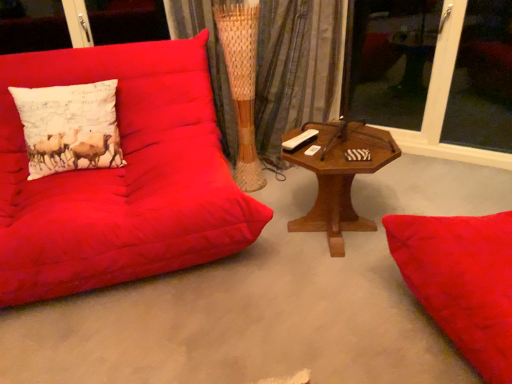
Question: Are transparent glass window at upper right, marked as the 2th window screen in a right-to-left arrangement, and woven fabric curtain at center located far from each other?

Choices:
 (A) yes
 (B) no

Answer: (A)

Question: From the image's perspective, would you say transparent glass window at upper right, the 1th window screen when ordered from left to right, is positioned over woven fabric curtain at center?

Choices:
 (A) yes
 (B) no

Answer: (A)

Question: Is transparent glass window at upper right, marked as the 2th window screen in a right-to-left arrangement, to the right of woven fabric curtain at center from the viewer's perspective?

Choices:
 (A) no
 (B) yes

Answer: (B)

Question: Is transparent glass window at upper right, the 1th window screen when ordered from left to right, looking in the opposite direction of woven fabric curtain at center?

Choices:
 (A) yes
 (B) no

Answer: (B)

Question: From the image's perspective, is transparent glass window at upper right, the 1th window screen when ordered from left to right, below woven fabric curtain at center?

Choices:
 (A) yes
 (B) no

Answer: (B)

Question: Is transparent glass window at upper right, marked as the 2th window screen in a right-to-left arrangement, positioned behind woven fabric curtain at center?

Choices:
 (A) no
 (B) yes

Answer: (A)

Question: Is transparent glass window at upper right, which ranks as the 1th window screen in right-to-left order, taller than matte red couch at left?

Choices:
 (A) no
 (B) yes

Answer: (B)

Question: Is transparent glass window at upper right, which ranks as the 1th window screen in right-to-left order, closer to camera compared to matte red couch at left?

Choices:
 (A) yes
 (B) no

Answer: (B)

Question: From the image's perspective, is transparent glass window at upper right, the 2th window screen from the left, over matte red couch at left?

Choices:
 (A) no
 (B) yes

Answer: (B)

Question: Does transparent glass window at upper right, the 2th window screen from the left, have a smaller size compared to matte red couch at left?

Choices:
 (A) no
 (B) yes

Answer: (B)

Question: Considering the relative sizes of transparent glass window at upper right, which ranks as the 1th window screen in right-to-left order, and matte red couch at left in the image provided, is transparent glass window at upper right, which ranks as the 1th window screen in right-to-left order, bigger than matte red couch at left?

Choices:
 (A) yes
 (B) no

Answer: (B)

Question: Is the surface of transparent glass window at upper right, which ranks as the 1th window screen in right-to-left order, in direct contact with matte red couch at left?

Choices:
 (A) yes
 (B) no

Answer: (B)

Question: From a real-world perspective, is transparent glass window at upper right, the 1th window screen when ordered from left to right, under woodenobject at center?

Choices:
 (A) no
 (B) yes

Answer: (A)